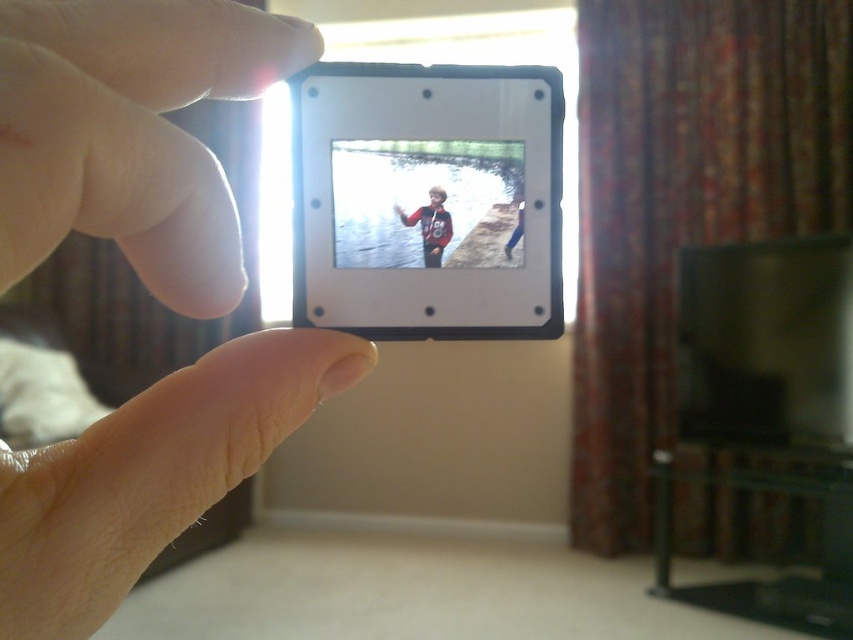
You are a photographer trying to frame a shot. You need to position the white matte hand at upper left and the matte red shirt at center so that they are exactly 6.75 inches apart. Given that the camera you are using has a focal length of 50mm, what is the minimum distance you should stand from the scene to achieve this spacing?

The white matte hand at upper left is 6.75 inches from the matte red shirt at center. To achieve this spacing with a 50mm lens, you should position yourself approximately 6.75 inches away from the scene. However, this is a simplified calculation and real distances may vary based on camera sensor size and other factors.

You are examining the slide and notice two points marked on it. The first is at coordinates point [204,0] and the second at point [432,209]. From your perspective, which point is nearer to you?

Point [204,0] is closer to the viewer than point [432,209].

You are a photographer trying to position a white plastic photo frame at center for a close up shot. Where should you place your camera to capture the frame perfectly?

Place your camera directly in front of the white plastic photo frame at center at point coordinates (422,196) to capture it perfectly.